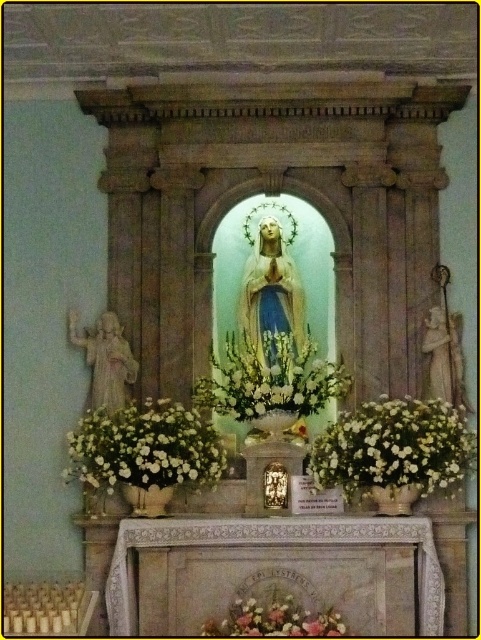
You are standing in front of the religious altar setup. You want to place a new candle holder exactly at the point marked by coordinates point (393, 449). What object will the candle holder be placed on?

The point (393, 449) corresponds to the white matte floral arrangement at center, so the candle holder will be placed on the white matte floral arrangement at center.

Looking at this image, you are standing in front of the religious altar and want to place a small candle between the two points mentioned. Can you determine if the point at coordinates point (471,460) is closer to you than point (226,618)?

Point (471,460) is behind point (226,618), so the point at (226,618) is closer to you than the other point.